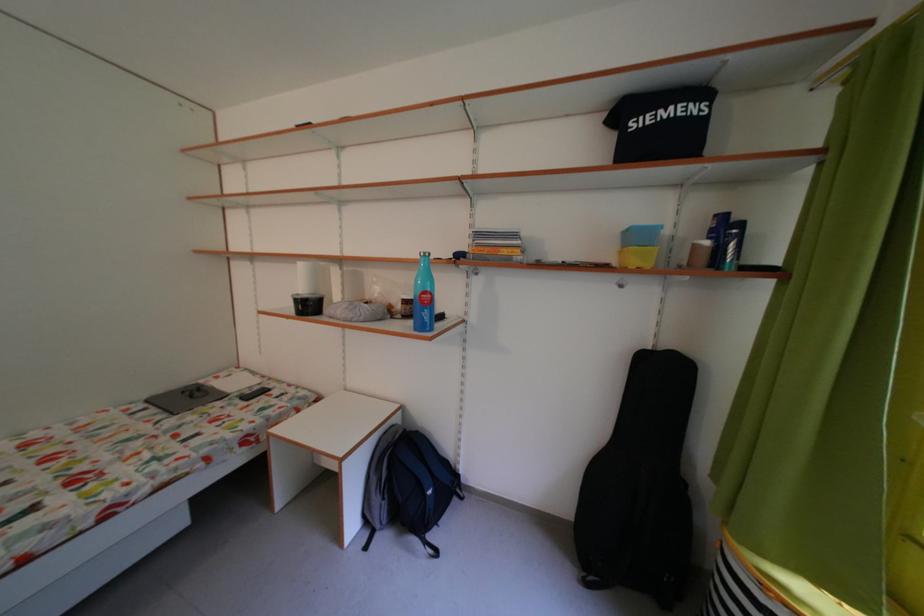
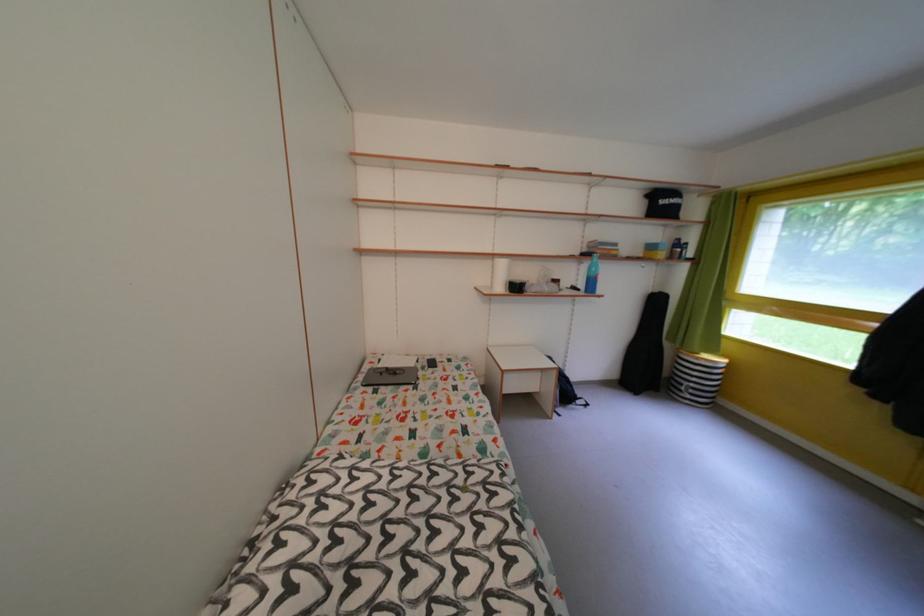
Question: Which direction would the cameraman need to move to produce the second image? Reply with the corresponding letter.

Choices:
 (A) Left
 (B) Right
 (C) Forward
 (D) Backward

Answer: (A)